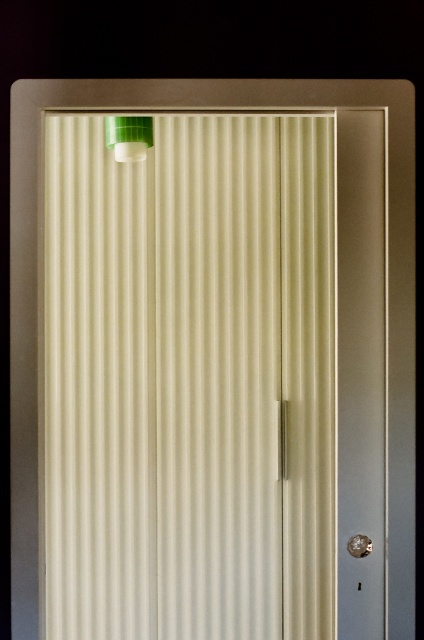
Does white ribbed curtain at upper center have a lesser height compared to green plastic cap at upper left?

Incorrect, white ribbed curtain at upper center's height does not fall short of green plastic cap at upper left's.

Find the location of a particular element. white ribbed curtain at upper center is located at coordinates (189, 378).

You are a GUI agent. You are given a task and a screenshot of the screen. Output one action in this format:
    pyautogui.click(x=<x>, y=<y>)
    Task: Click on the white ribbed curtain at upper center
    The image size is (424, 640).
    Given the screenshot: What is the action you would take?
    (x=189, y=378)